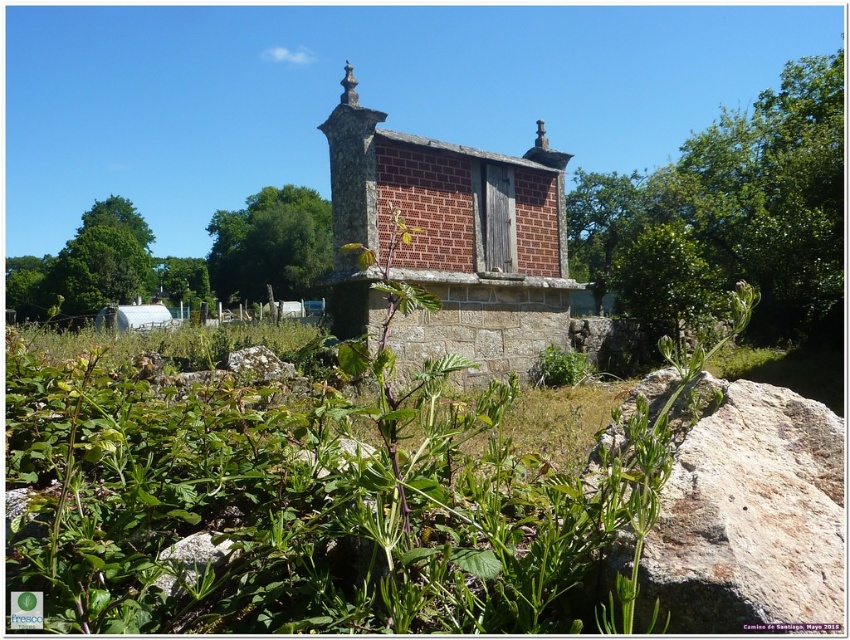
Who is taller, green leafy tree at upper center or brown brick church at center?

With more height is green leafy tree at upper center.

Between point (666, 177) and point (429, 141), which one is positioned in front?

Positioned in front is point (429, 141).

I want to click on green leafy tree at upper center, so click(x=729, y=214).

From the picture: Between green leafy tree at upper center and green leafy tree at lower left, which one is positioned lower?

Positioned lower is green leafy tree at lower left.

Who is shorter, green leafy tree at upper center or green leafy tree at lower left?

With less height is green leafy tree at lower left.

I want to click on green leafy tree at upper center, so click(x=729, y=214).

Find the location of a particular element. green leafy tree at upper center is located at coordinates (729, 214).

Does green leafy tree at upper center appear on the left side of green leafy tree at center?

In fact, green leafy tree at upper center is to the right of green leafy tree at center.

Can you confirm if green leafy tree at upper center is bigger than green leafy tree at center?

Indeed, green leafy tree at upper center has a larger size compared to green leafy tree at center.

Which is in front, point (686, 225) or point (306, 205)?

Point (686, 225) is more forward.

The width and height of the screenshot is (850, 640). I want to click on green leafy tree at upper center, so click(x=729, y=214).